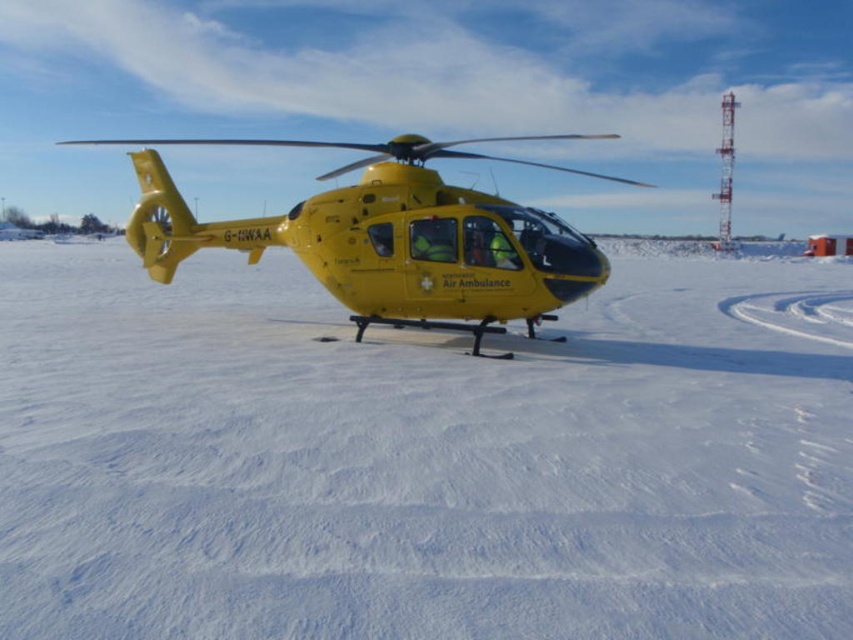
Does white matte snow at center have a lesser width compared to yellow matte helicopter at center?

Correct, white matte snow at center's width is less than yellow matte helicopter at center's.

Looking at this image, can you confirm if white matte snow at center is wider than yellow matte helicopter at center?

No, white matte snow at center is not wider than yellow matte helicopter at center.

Where is `white matte snow at center`? The height and width of the screenshot is (640, 853). white matte snow at center is located at coordinates (421, 458).